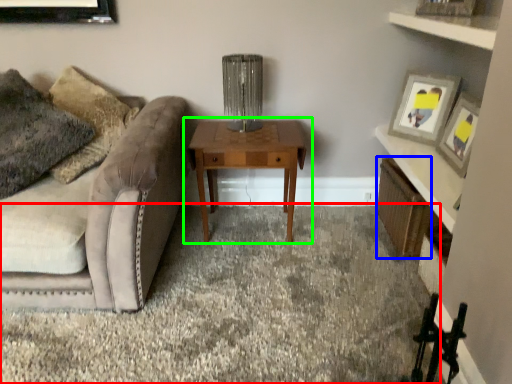
Question: Considering the real-world distances, which object is farthest from plain (highlighted by a red box)? shelf (highlighted by a blue box) or table (highlighted by a green box)?

Choices:
 (A) shelf
 (B) table

Answer: (A)